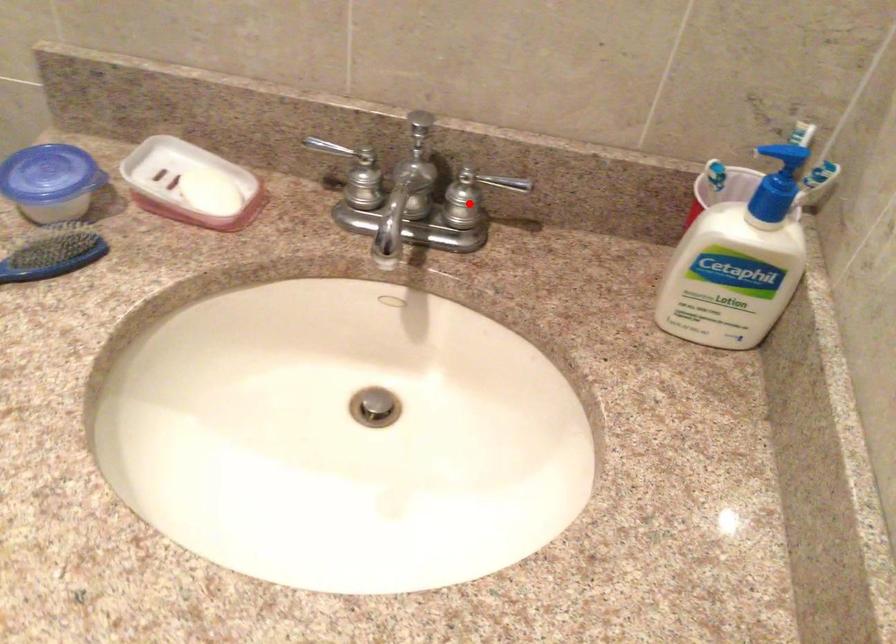
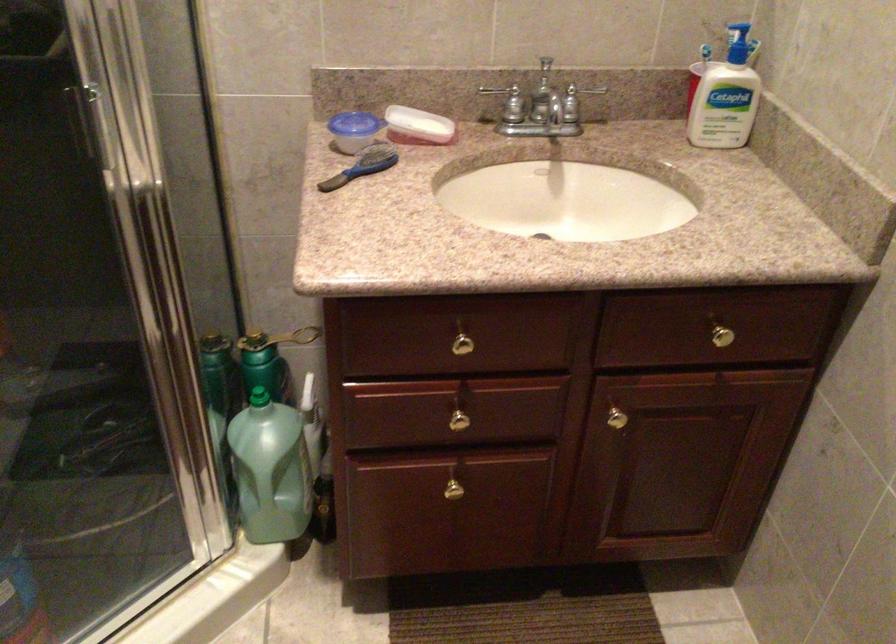
Locate, in the second image, the point that corresponds to the highlighted location in the first image.

(574, 105)